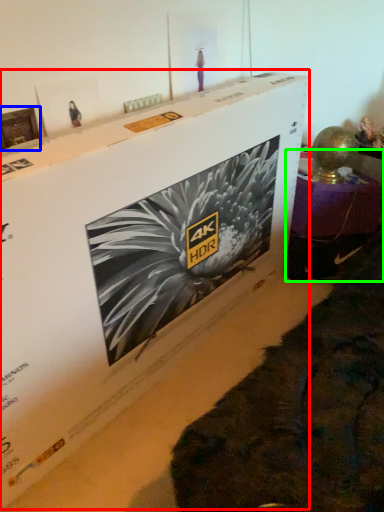
Question: Estimate the real-world distances between objects in this image. Which object is farther from cardboard box (highlighted by a red box), picture frame (highlighted by a blue box) or furniture (highlighted by a green box)?

Choices:
 (A) picture frame
 (B) furniture

Answer: (B)